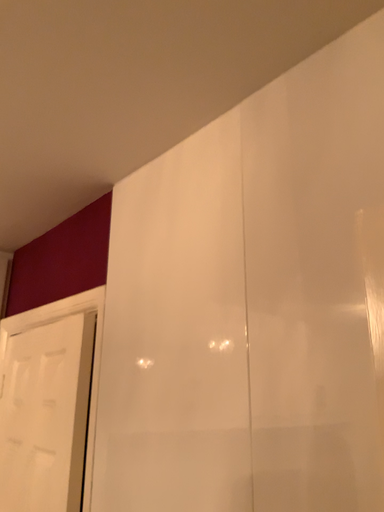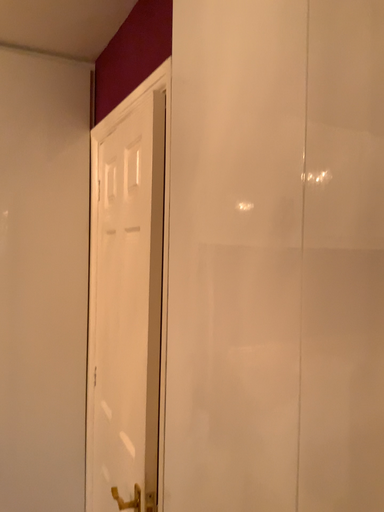
Question: How did the camera likely rotate when shooting the video?

Choices:
 (A) rotated right
 (B) rotated left

Answer: (B)